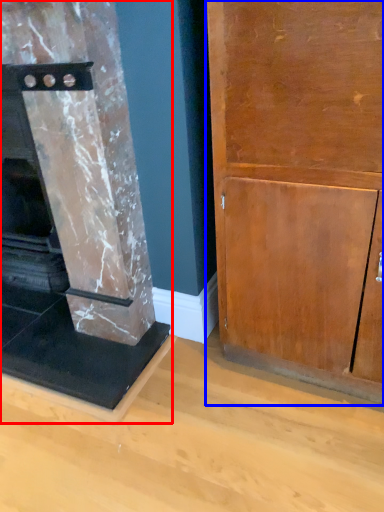
Question: Which object appears farthest to the camera in this image, fireplace (highlighted by a red box) or cupboard (highlighted by a blue box)?

Choices:
 (A) fireplace
 (B) cupboard

Answer: (A)